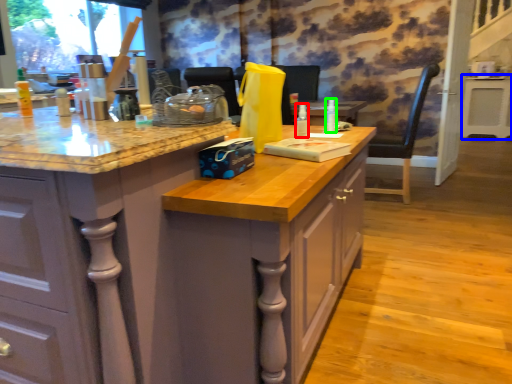
Question: Estimate the real-world distances between objects in this image. Which object is farther from bottle (highlighted by a red box), table (highlighted by a blue box) or bottle (highlighted by a green box)?

Choices:
 (A) table
 (B) bottle

Answer: (A)